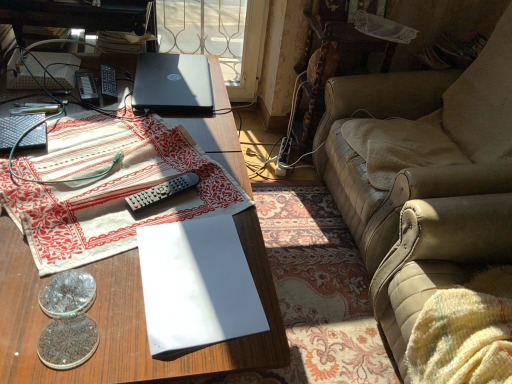
The image size is (512, 384). Find the location of `free space to the left of shiny metallic coin at lower left, placed as the 1th coin when sorted from back to front`. free space to the left of shiny metallic coin at lower left, placed as the 1th coin when sorted from back to front is located at coordinates (20, 264).